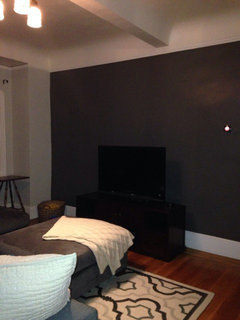
Identify the location of rug. Image resolution: width=240 pixels, height=320 pixels. (179, 295), (127, 311).